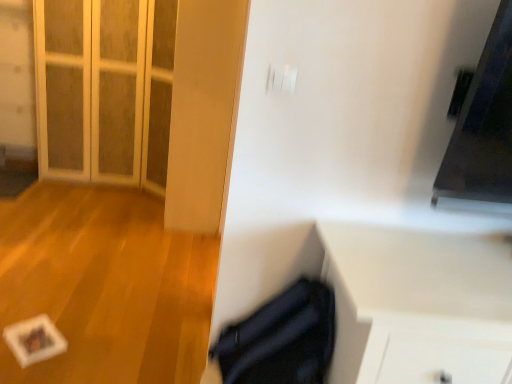
Question: Is white matte paper at lower left bigger than white glass door at upper left?

Choices:
 (A) no
 (B) yes

Answer: (A)

Question: Does white matte paper at lower left have a greater height compared to white glass door at upper left?

Choices:
 (A) yes
 (B) no

Answer: (B)

Question: Is white matte paper at lower left far from white glass door at upper left?

Choices:
 (A) yes
 (B) no

Answer: (A)

Question: Are white matte paper at lower left and white glass door at upper left beside each other?

Choices:
 (A) yes
 (B) no

Answer: (B)

Question: Is white matte paper at lower left not within white glass door at upper left?

Choices:
 (A) yes
 (B) no

Answer: (A)

Question: Could you tell me if white matte paper at lower left is facing white glass door at upper left?

Choices:
 (A) no
 (B) yes

Answer: (A)

Question: Would you say white glass door at upper left is outside white matte cabinet at lower right?

Choices:
 (A) no
 (B) yes

Answer: (B)

Question: Considering the relative sizes of white glass door at upper left and white matte cabinet at lower right in the image provided, is white glass door at upper left smaller than white matte cabinet at lower right?

Choices:
 (A) yes
 (B) no

Answer: (B)

Question: Can you confirm if white glass door at upper left is wider than white matte cabinet at lower right?

Choices:
 (A) no
 (B) yes

Answer: (B)

Question: Would you consider white glass door at upper left to be distant from white matte cabinet at lower right?

Choices:
 (A) no
 (B) yes

Answer: (B)

Question: From a real-world perspective, is white glass door at upper left on white matte cabinet at lower right?

Choices:
 (A) no
 (B) yes

Answer: (B)

Question: Is white glass door at upper left aimed at white matte cabinet at lower right?

Choices:
 (A) yes
 (B) no

Answer: (B)

Question: Is white matte cabinet at lower right thinner than white matte paper at lower left?

Choices:
 (A) yes
 (B) no

Answer: (A)